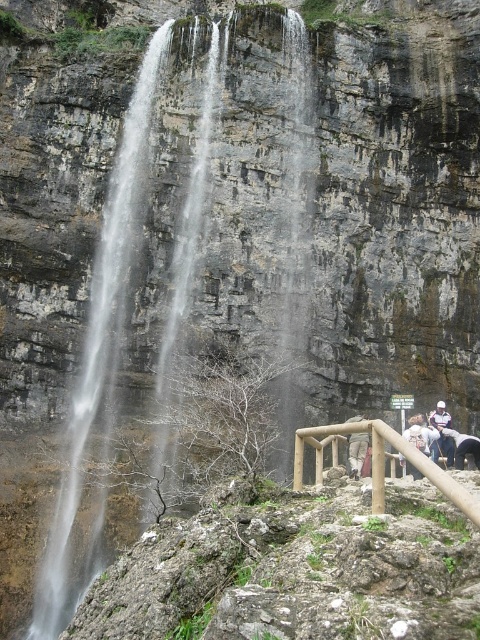
Can you confirm if dark gray stone person at lower right is smaller than camouflage pants at center?

Yes.

Between dark gray stone person at lower right and camouflage pants at center, which one appears on the right side from the viewer's perspective?

dark gray stone person at lower right is more to the right.

What do you see at coordinates (463, 445) in the screenshot?
I see `dark gray stone person at lower right` at bounding box center [463, 445].

Locate an element on the screen. dark gray stone person at lower right is located at coordinates (463, 445).

Between white leather jacket at lower right and camouflage pants at center, which one appears on the left side from the viewer's perspective?

camouflage pants at center

Is point (446, 436) positioned behind point (357, 460)?

That is True.

In order to click on white leather jacket at lower right in this screenshot , I will do `click(441, 433)`.

Does point (459, 444) lie behind point (408, 465)?

Yes, it is.

Is white cotton jacket at lower right thinner than light brown wooden post at lower right?

No.

Locate an element on the screen. The width and height of the screenshot is (480, 640). white cotton jacket at lower right is located at coordinates (442, 438).